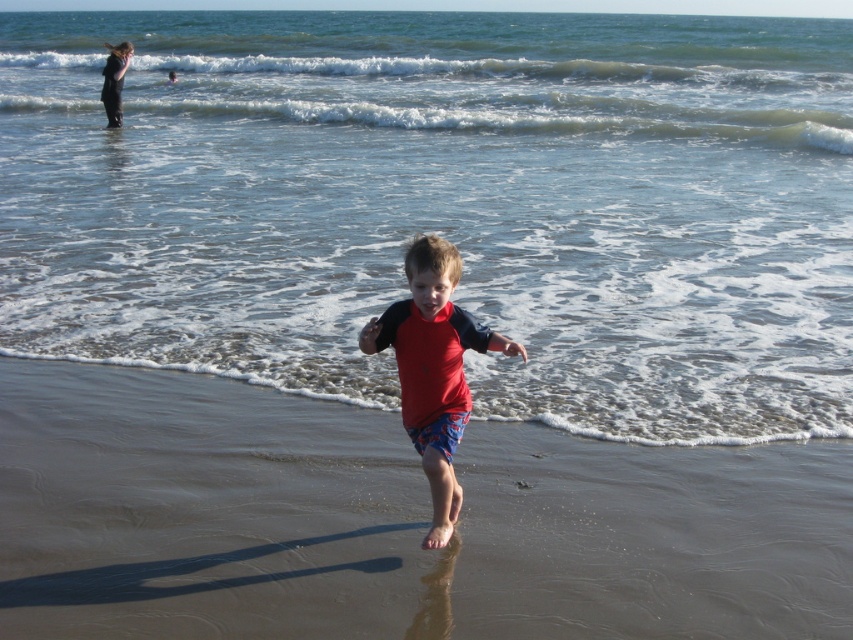
You are a swimmer looking to enter the water. You see the clear water at lower center and the red matte wetsuit at center. Which one is closer to the water surface?

The clear water at lower center is above the red matte wetsuit at center, so the clear water at lower center is closer to the water surface.

You are a photographer trying to capture the child in the scene. Since the clear water at lower center and the red matte wetsuit at center are both in view, which one takes up more space in the photo?

The clear water at lower center takes up more space in the photo because it is bigger than the red matte wetsuit at center according to the description.

You are a swimmer planning to enter the water. You see the clear water at lower center and the red matte wetsuit at center. Which one is higher up from the ground?

The clear water at lower center is much taller than the red matte wetsuit at center, so the clear water at lower center is higher up from the ground.